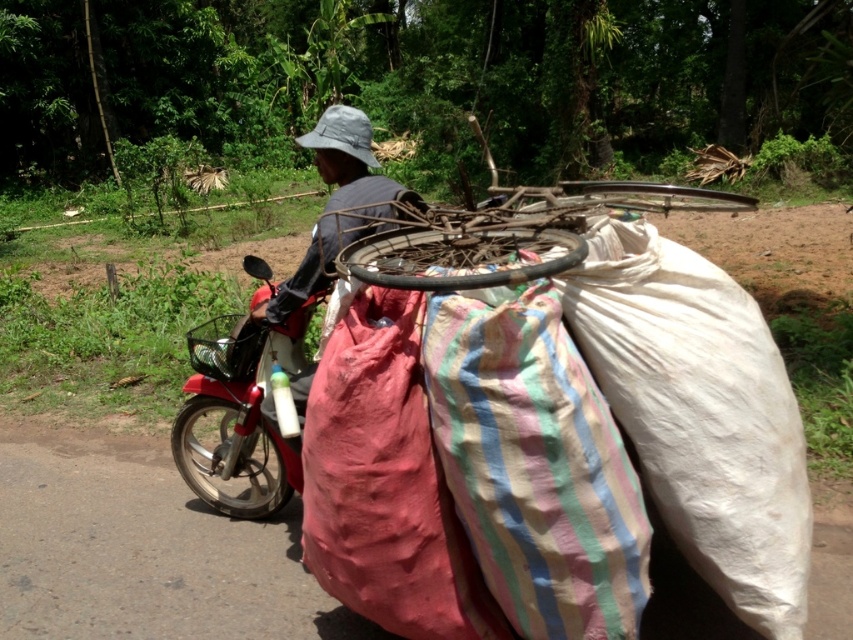
Question: From the image, what is the correct spatial relationship of wooden bicycle wheel at center in relation to camouflage fabric hat at upper center?

Choices:
 (A) above
 (B) below

Answer: (A)

Question: In this image, where is metallic red motorcycle at left located relative to camouflage fabric hat at upper center?

Choices:
 (A) above
 (B) below

Answer: (B)

Question: Which object is positioned closest to the camouflage fabric hat at upper center?

Choices:
 (A) wooden bicycle wheel at center
 (B) metallic red motorcycle at left

Answer: (B)

Question: Is metallic red motorcycle at left thinner than camouflage fabric hat at upper center?

Choices:
 (A) no
 (B) yes

Answer: (A)

Question: Which point is closer to the camera?

Choices:
 (A) wooden bicycle wheel at center
 (B) camouflage fabric hat at upper center

Answer: (A)

Question: Among these points, which one is nearest to the camera?

Choices:
 (A) (666, 196)
 (B) (281, 317)
 (C) (273, 445)

Answer: (A)